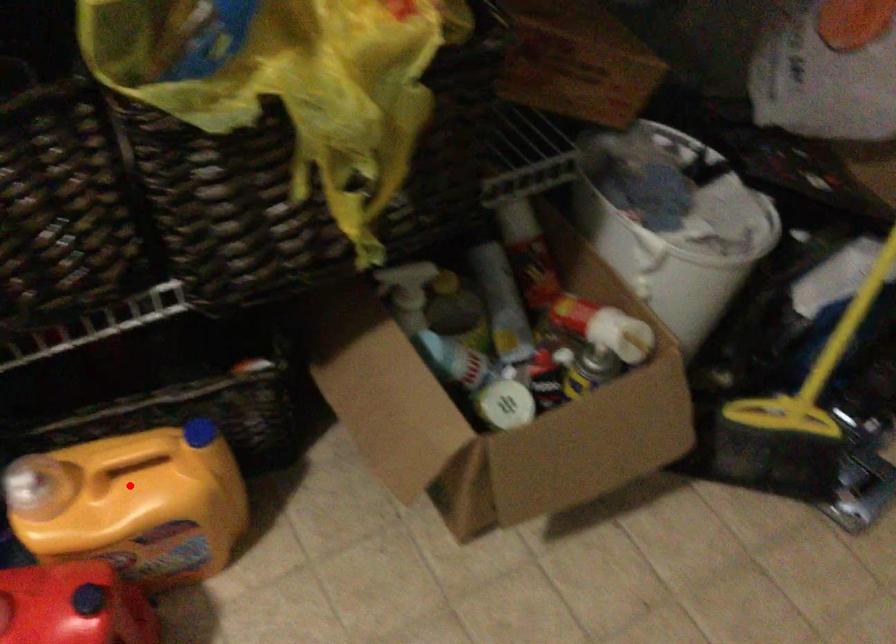
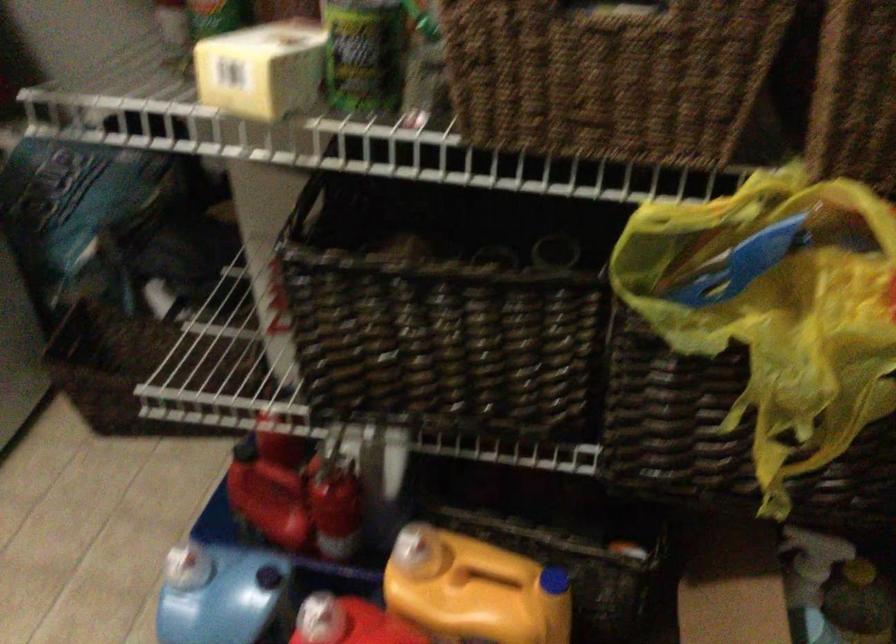
Where in the second image is the point corresponding to the highlighted location from the first image?

(474, 590)